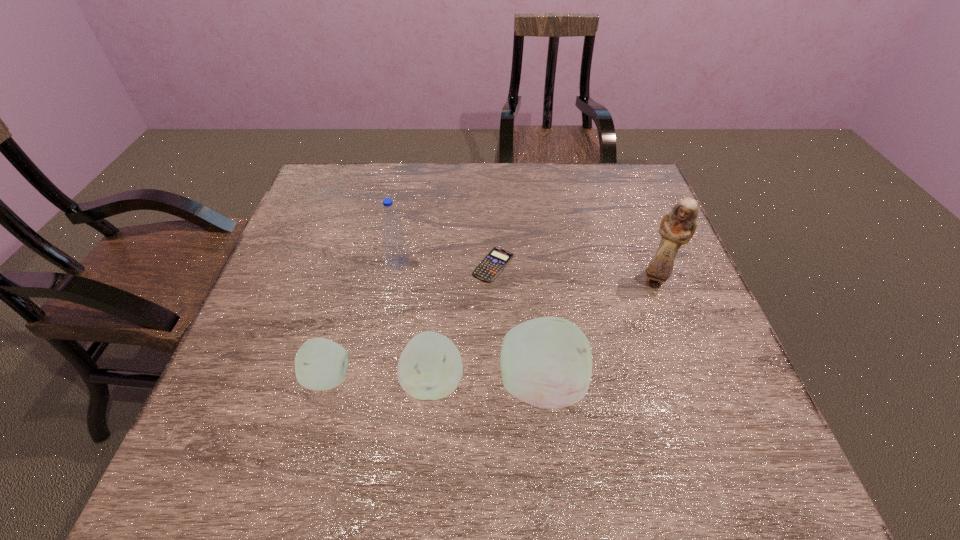
Find the location of a particular element. The height and width of the screenshot is (540, 960). vacant region between the fifth tallest object and the tallest object is located at coordinates (492, 329).

Where is `free spot between the rightmost apple and the calculator`? The height and width of the screenshot is (540, 960). free spot between the rightmost apple and the calculator is located at coordinates (516, 325).

Where is `object identified as the fifth closest to the shortest object`? object identified as the fifth closest to the shortest object is located at coordinates (320, 364).

Identify which object is the third nearest to the tallest apple. Please provide its 2D coordinates. Your answer should be formatted as a tuple, i.e. [(x, y)], where the tuple contains the x and y coordinates of a point satisfying the conditions above.

[(677, 227)]

What are the coordinates of `the third closest apple to the tallest object` in the screenshot? It's located at (320, 364).

Where is `apple that stands as the second closest to the tallest apple`? The image size is (960, 540). apple that stands as the second closest to the tallest apple is located at coordinates (320, 364).

Find the location of a particular element. The image size is (960, 540). vacant point that satisfies the following two spatial constraints: 1. on the front side of the tallest apple; 2. on the right side of the leftmost object is located at coordinates (326, 385).

Where is `free space that satisfies the following two spatial constraints: 1. on the front side of the shortest object; 2. on the left side of the tallest apple`? This screenshot has height=540, width=960. free space that satisfies the following two spatial constraints: 1. on the front side of the shortest object; 2. on the left side of the tallest apple is located at coordinates (497, 385).